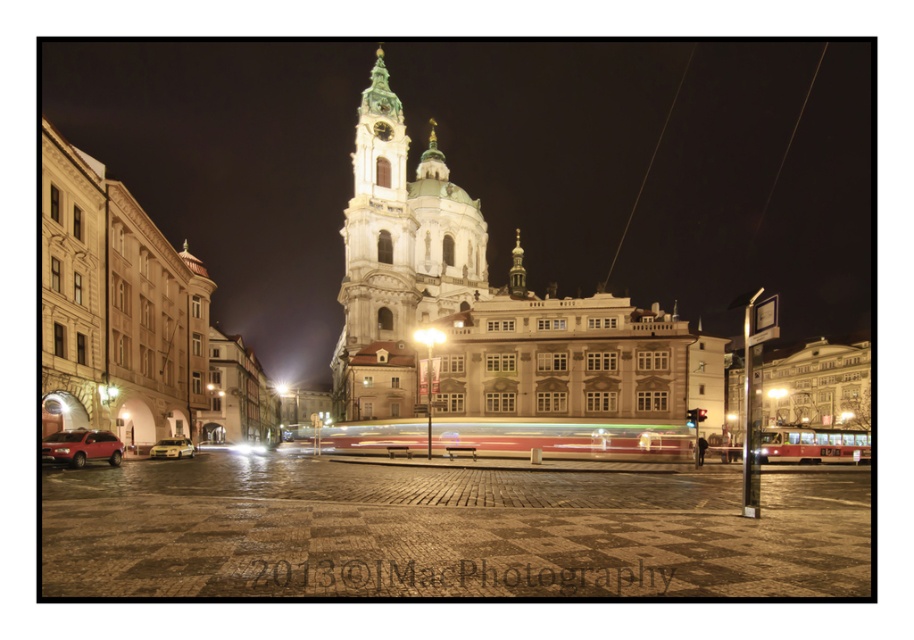
Question: Which object is the farthest from the brick pavement at center?

Choices:
 (A) matte red suv at lower left
 (B) metallic gold car at lower left
 (C) white stone church at center

Answer: (B)

Question: Can you confirm if brick pavement at center is positioned below matte red suv at lower left?

Choices:
 (A) no
 (B) yes

Answer: (B)

Question: In this image, where is brick pavement at center located relative to matte red suv at lower left?

Choices:
 (A) left
 (B) right

Answer: (B)

Question: Is brick pavement at center smaller than metallic gold car at lower left?

Choices:
 (A) yes
 (B) no

Answer: (B)

Question: Among these objects, which one is nearest to the camera?

Choices:
 (A) matte red suv at lower left
 (B) metallic gold car at lower left
 (C) brick pavement at center

Answer: (C)

Question: Which of the following is the farthest from the observer?

Choices:
 (A) white stone church at center
 (B) matte red suv at lower left

Answer: (A)